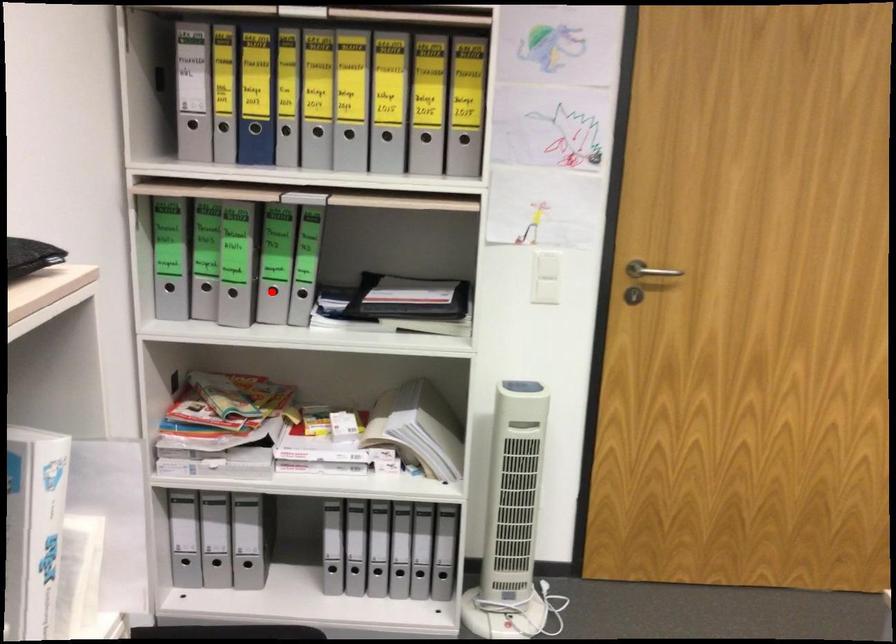
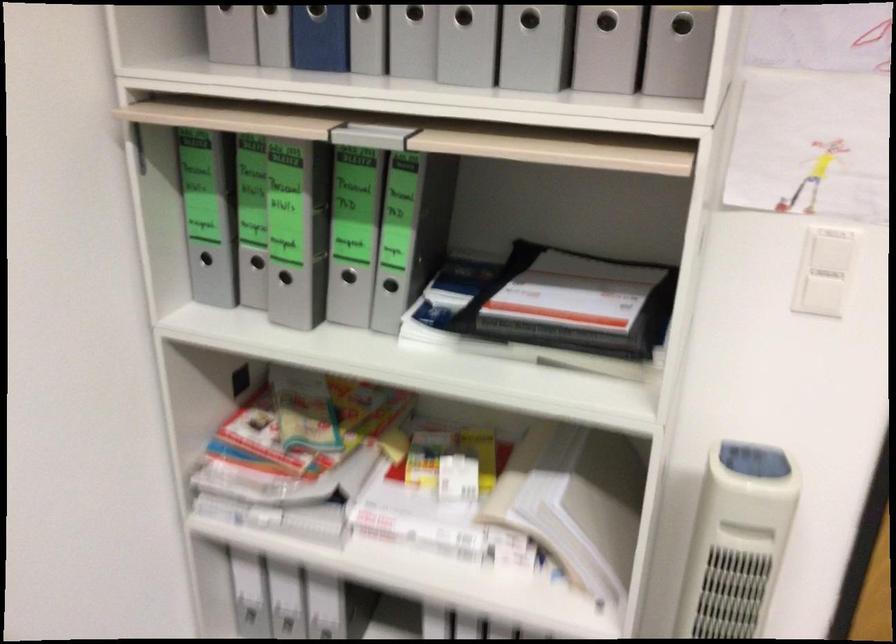
Question: I am providing you with two images of the same scene from different viewpoints. A red point is marked on the first image. At the location where the point appears in image 1, is it still visible in image 2?

Choices:
 (A) Yes
 (B) No

Answer: (A)